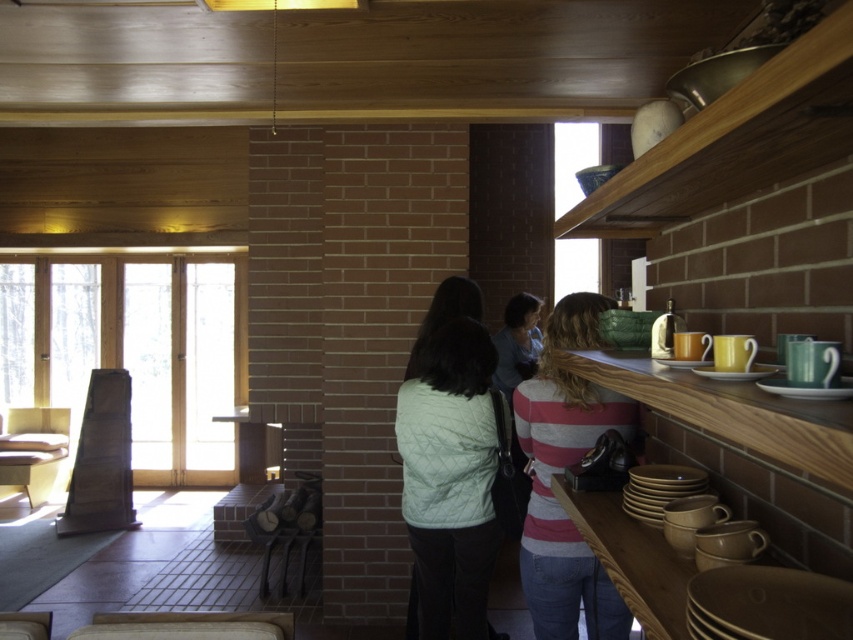
Does point (762, 369) come behind point (693, 360)?

No, it is not.

Is matte brown plate at shelf center above matte yellow plate at upper right?

No.

In order to click on matte brown plate at shelf center in this screenshot , I will do `click(734, 372)`.

Who is positioned more to the left, light green quilted vest at center or striped cotton shirt at upper right?

Positioned to the left is light green quilted vest at center.

Is point (467, 561) more distant than point (579, 337)?

Yes, point (467, 561) is behind point (579, 337).

Is point (442, 394) farther from camera compared to point (544, 627)?

Yes, point (442, 394) is behind point (544, 627).

Find the location of `light green quilted vest at center`. light green quilted vest at center is located at coordinates (450, 476).

Is striped cotton shirt at upper right smaller than light green quilted jacket at center?

Incorrect, striped cotton shirt at upper right is not smaller in size than light green quilted jacket at center.

Which is in front, point (543, 346) or point (426, 326)?

Positioned in front is point (543, 346).

The height and width of the screenshot is (640, 853). What do you see at coordinates (561, 472) in the screenshot? I see `striped cotton shirt at upper right` at bounding box center [561, 472].

Image resolution: width=853 pixels, height=640 pixels. Identify the location of striped cotton shirt at upper right. (561, 472).